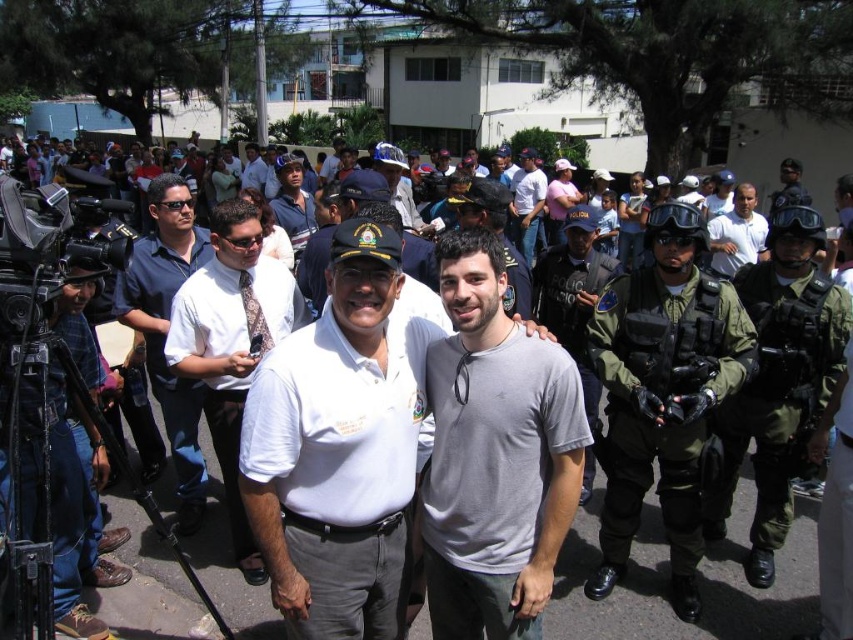
You are a photographer at the event and need to position yourself to capture both the matte black shirt at left and the other individuals in the scene. Based on their positions, where should you stand to ensure both are in frame?

The matte black shirt at left is located at point (x=167, y=328), so you should position yourself centrally to include both the matte black shirt at left and the other individuals in the scene.

You are standing at the point labeled point (457,604) and want to move to point (242,253). Given that both points are in the same scene, which direction should you move to get closer to the camera?

Since point (457,604) is closer to the camera than point (242,253), you should move towards point (242,253) to get closer to the camera.

Consider the image. You are organizing a group photo and need to arrange two people standing side by side. The white uniform at center and the white shirt at center are both willing to participate. Given their widths, which person should stand on the left to allow more space between them and the next person on the right?

The white uniform at center has a smaller width than the white shirt at center. To allow more space between them and the next person on the right, the white uniform at center should stand on the left since it takes up less space, leaving more room for the next individual on the right side.